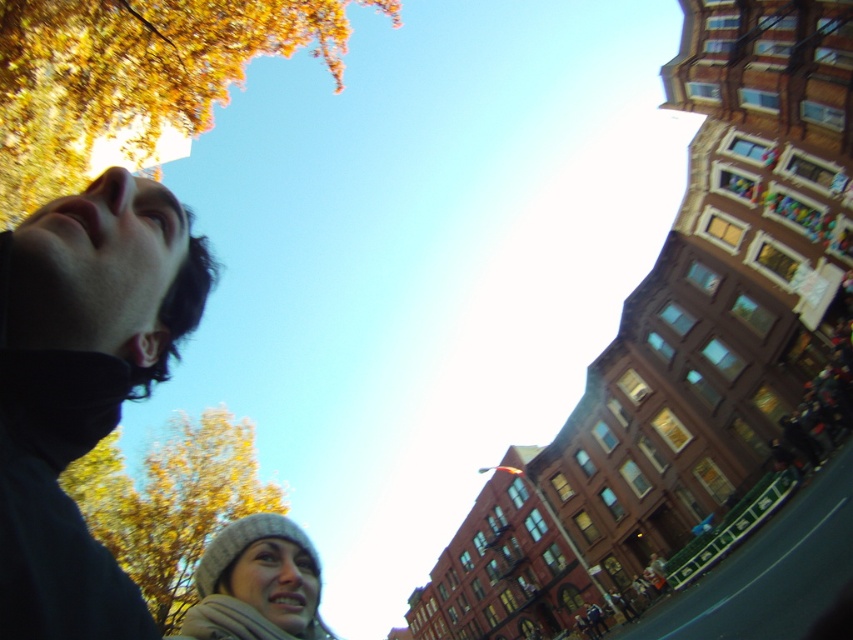
You are standing at the point with coordinates point [216,621] and want to walk towards the point with coordinates point [299,593]. Will you be moving forward or backward in relation to the direction you are facing?

Since point [299,593] is behind point [216,621], you would be moving backward to reach it.

Looking up at the bright blue sky, you notice a dark gray fabric face at upper left and a golden leafy tree at upper left. Which one is closer to you?

The dark gray fabric face at upper left is closer to you because it is shorter than the golden leafy tree at upper left, indicating it is in a lower position in the scene.

You are a photographer trying to capture a photo of both the dark gray fabric face at upper left and the knitted gray hat at lower left. Given their positions, which one would appear larger in the final photograph?

The dark gray fabric face at upper left would appear larger in the photograph since it is much taller than the knitted gray hat at lower left.